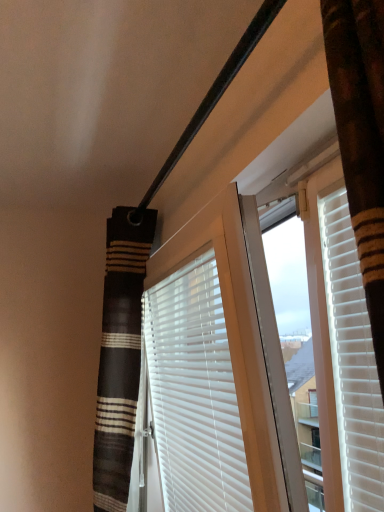
Measure the distance between striped fabric shower curtain at left and camera.

They are 4.90 feet apart.

The height and width of the screenshot is (512, 384). What do you see at coordinates (120, 354) in the screenshot?
I see `striped fabric shower curtain at left` at bounding box center [120, 354].

Find the location of a particular element. striped fabric shower curtain at left is located at coordinates (120, 354).

What do you see at coordinates (194, 392) in the screenshot? I see `white matte blinds at center` at bounding box center [194, 392].

This screenshot has height=512, width=384. Find the location of `white matte blinds at center`. white matte blinds at center is located at coordinates coord(194,392).

Image resolution: width=384 pixels, height=512 pixels. What are the coordinates of `striped fabric shower curtain at left` in the screenshot? It's located at (120, 354).

Considering the relative positions of striped fabric shower curtain at left and white matte blinds at center in the image provided, is striped fabric shower curtain at left to the left or to the right of white matte blinds at center?

From the image, it's evident that striped fabric shower curtain at left is to the left of white matte blinds at center.

Is the position of striped fabric shower curtain at left less distant than that of white matte blinds at center?

No.

Is point (136, 246) closer or farther from the camera than point (190, 418)?

Point (136, 246) is farther from the camera than point (190, 418).

From the image's perspective, between striped fabric shower curtain at left and white matte blinds at center, which one is located above?

white matte blinds at center, from the image's perspective.

From a real-world perspective, does striped fabric shower curtain at left sit lower than white matte blinds at center?

Incorrect, from a real-world perspective, striped fabric shower curtain at left is higher than white matte blinds at center.

Considering the sizes of objects striped fabric shower curtain at left and white matte blinds at center in the image provided, who is thinner, striped fabric shower curtain at left or white matte blinds at center?

white matte blinds at center is thinner.

Can you confirm if striped fabric shower curtain at left is shorter than white matte blinds at center?

Incorrect, the height of striped fabric shower curtain at left does not fall short of that of white matte blinds at center.

Does striped fabric shower curtain at left have a larger size compared to white matte blinds at center?

Yes, striped fabric shower curtain at left is bigger than white matte blinds at center.

From the picture: Choose the correct answer: Is striped fabric shower curtain at left inside white matte blinds at center or outside it?

striped fabric shower curtain at left is spatially situated outside white matte blinds at center.

Based on the photo, are striped fabric shower curtain at left and white matte blinds at center beside each other?

striped fabric shower curtain at left and white matte blinds at center are not in contact.

Is striped fabric shower curtain at left looking in the opposite direction of white matte blinds at center?

That's not correct — striped fabric shower curtain at left is not looking away from white matte blinds at center.

Based on the photo, can you tell me how much striped fabric shower curtain at left and white matte blinds at center differ in facing direction?

The angular difference between striped fabric shower curtain at left and white matte blinds at center is 6.62 degrees.

In the image, there is a striped fabric shower curtain at left. Where is `window blind below it (from a real-world perspective)`? This screenshot has width=384, height=512. window blind below it (from a real-world perspective) is located at coordinates (194, 392).

Can you confirm if white matte blinds at center is positioned to the right of striped fabric shower curtain at left?

Indeed, white matte blinds at center is positioned on the right side of striped fabric shower curtain at left.

Considering the positions of objects white matte blinds at center and striped fabric shower curtain at left in the image provided, who is behind, white matte blinds at center or striped fabric shower curtain at left?

striped fabric shower curtain at left is behind.

Between point (183, 398) and point (139, 240), which one is positioned in front?

The point (183, 398) is in front.

From the image's perspective, is white matte blinds at center above or below striped fabric shower curtain at left?

white matte blinds at center is situated higher than striped fabric shower curtain at left in the image.

From a real-world perspective, who is located higher, white matte blinds at center or striped fabric shower curtain at left?

striped fabric shower curtain at left is physically above.

Between white matte blinds at center and striped fabric shower curtain at left, which one has smaller width?

Thinner between the two is white matte blinds at center.

Is white matte blinds at center taller or shorter than striped fabric shower curtain at left?

Clearly, white matte blinds at center is shorter compared to striped fabric shower curtain at left.

Is white matte blinds at center smaller than striped fabric shower curtain at left?

Correct, white matte blinds at center occupies less space than striped fabric shower curtain at left.

Would you say white matte blinds at center is outside striped fabric shower curtain at left?

Indeed, white matte blinds at center is completely outside striped fabric shower curtain at left.

Is white matte blinds at center next to striped fabric shower curtain at left and touching it?

There is a gap between white matte blinds at center and striped fabric shower curtain at left.

Based on the photo, is white matte blinds at center oriented away from striped fabric shower curtain at left?

No, white matte blinds at center's orientation is not away from striped fabric shower curtain at left.

Image resolution: width=384 pixels, height=512 pixels. What are the coordinates of `window blind below the striped fabric shower curtain at left (from a real-world perspective)` in the screenshot? It's located at (194, 392).

Locate an element on the screen. Image resolution: width=384 pixels, height=512 pixels. shower curtain behind the white matte blinds at center is located at coordinates (120, 354).

What are the coordinates of `window blind on the right of striped fabric shower curtain at left` in the screenshot? It's located at (194, 392).